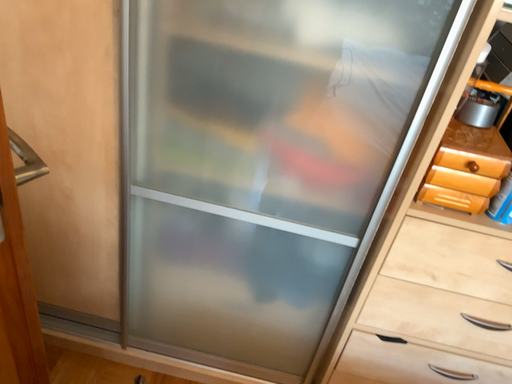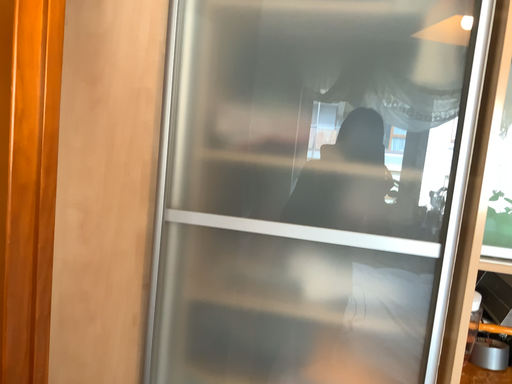
Question: How did the camera likely rotate when shooting the video?

Choices:
 (A) rotated downward
 (B) rotated upward

Answer: (B)